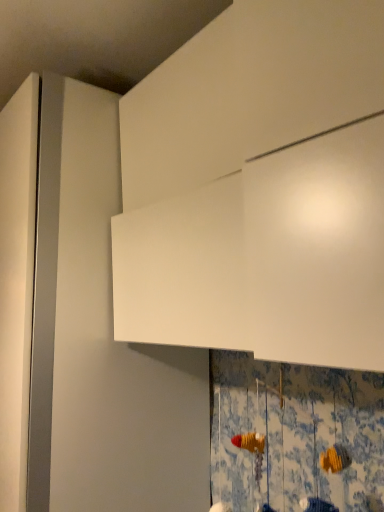
Where is `white matte cabinet at upper center`? white matte cabinet at upper center is located at coordinates (265, 257).

The image size is (384, 512). What do you see at coordinates (265, 257) in the screenshot?
I see `white matte cabinet at upper center` at bounding box center [265, 257].

Where is `white matte cabinet at upper center`? white matte cabinet at upper center is located at coordinates (265, 257).